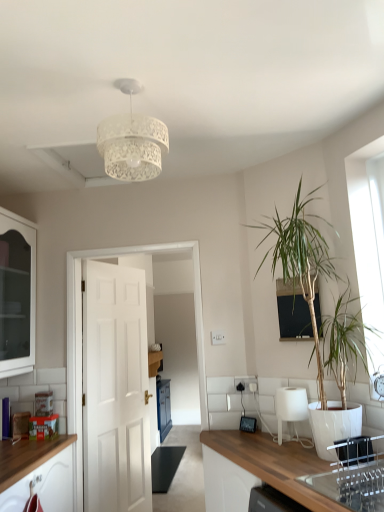
What do you see at coordinates (292, 411) in the screenshot? The image size is (384, 512). I see `white glossy lampshade at lower center` at bounding box center [292, 411].

Where is `green leafy plant at right`? Image resolution: width=384 pixels, height=512 pixels. green leafy plant at right is located at coordinates (301, 260).

What do you see at coordinates (353, 475) in the screenshot?
I see `clear glass sink at lower right` at bounding box center [353, 475].

Where is `white glossy lampshade at lower center`? Image resolution: width=384 pixels, height=512 pixels. white glossy lampshade at lower center is located at coordinates (292, 411).

Where is `appliance below the black glass window screen at upper center (from a real-world perspective)`? This screenshot has width=384, height=512. appliance below the black glass window screen at upper center (from a real-world perspective) is located at coordinates (x=292, y=411).

Does white glossy lampshade at lower center have a greater height compared to black glass window screen at upper center?

No, white glossy lampshade at lower center is not taller than black glass window screen at upper center.

Is point (281, 413) more distant than point (300, 321)?

No.

Which of these two, white glossy lampshade at lower center or black glass window screen at upper center, is thinner?

black glass window screen at upper center.

From the image's perspective, which one is positioned higher, black glass window screen at upper center or green leafy plant at right?

From the image's view, green leafy plant at right is above.

Considering the positions of objects black glass window screen at upper center and green leafy plant at right in the image provided, who is behind, black glass window screen at upper center or green leafy plant at right?

black glass window screen at upper center.

Between point (297, 336) and point (305, 240), which one is positioned in front?

The point (305, 240) is more forward.

Can you tell me how much black glass window screen at upper center and green leafy plant at right differ in facing direction?

There is a 14.5-degree angle between the facing directions of black glass window screen at upper center and green leafy plant at right.

Which is correct: white lace lampshade at upper center is inside green leafy plant at right, or outside of it?

The correct answer is: outside.

From a real-world perspective, between white lace lampshade at upper center and green leafy plant at right, who is vertically lower?

From a 3D spatial view, green leafy plant at right is below.

Considering the relative sizes of white lace lampshade at upper center and green leafy plant at right in the image provided, is white lace lampshade at upper center thinner than green leafy plant at right?

Correct, the width of white lace lampshade at upper center is less than that of green leafy plant at right.

How many degrees apart are the facing directions of white lace lampshade at upper center and green leafy plant at right?

The angle between the facing direction of white lace lampshade at upper center and the facing direction of green leafy plant at right is 25.8 degrees.

Considering the sizes of objects clear glass sink at lower right and white matte door at center in the image provided, who is thinner, clear glass sink at lower right or white matte door at center?

white matte door at center is thinner.

Does clear glass sink at lower right have a smaller size compared to white matte door at center?

Indeed, clear glass sink at lower right has a smaller size compared to white matte door at center.

Does clear glass sink at lower right lie in front of white matte door at center?

Yes, clear glass sink at lower right is closer to the viewer.

Is green leafy plant at right far from white glossy lampshade at lower center?

Actually, green leafy plant at right and white glossy lampshade at lower center are a little close together.

Do you think green leafy plant at right is within white glossy lampshade at lower center, or outside of it?

green leafy plant at right is not enclosed by white glossy lampshade at lower center.

Consider the image. From the image's perspective, is green leafy plant at right located above or below white glossy lampshade at lower center?

green leafy plant at right is above white glossy lampshade at lower center.

How different are the orientations of clear glass sink at lower right and white glass cabinet at left in degrees?

clear glass sink at lower right and white glass cabinet at left are facing 154 degrees away from each other.

Between clear glass sink at lower right and white glass cabinet at left, which one has smaller size?

clear glass sink at lower right.

From the image's perspective, is clear glass sink at lower right above or below white glass cabinet at left?

clear glass sink at lower right is below white glass cabinet at left.

How much distance is there between clear glass sink at lower right and white glass cabinet at left?

clear glass sink at lower right and white glass cabinet at left are 2.03 meters apart.

Considering the sizes of objects white lace lampshade at upper center and black glass window screen at upper center in the image provided, who is taller, white lace lampshade at upper center or black glass window screen at upper center?

With more height is black glass window screen at upper center.

From a real-world perspective, relative to black glass window screen at upper center, is white lace lampshade at upper center vertically above or below?

Clearly, from a real-world perspective, white lace lampshade at upper center is above black glass window screen at upper center.

This screenshot has height=512, width=384. Identify the location of lamp to the left of black glass window screen at upper center. (132, 141).

Where is `window screen above the white glossy lampshade at lower center (from the image's perspective)`? This screenshot has width=384, height=512. window screen above the white glossy lampshade at lower center (from the image's perspective) is located at coordinates (294, 317).

The height and width of the screenshot is (512, 384). In order to click on window screen that appears below the green leafy plant at right (from the image's perspective) in this screenshot , I will do `click(294, 317)`.

When comparing their distances from white lace lampshade at upper center, does green leafy plant at right or clear glass sink at lower right seem further?

clear glass sink at lower right lies further to white lace lampshade at upper center than the other object.

Based on their spatial positions, is black glass window screen at upper center or clear glass sink at lower right closer to white glass cabinet at left?

black glass window screen at upper center is positioned closer to the anchor white glass cabinet at left.

From the image, which object appears to be nearer to black glass window screen at upper center, green leafy plant at right or white glass cabinet at left?

The object closer to black glass window screen at upper center is green leafy plant at right.

When comparing their distances from white lace lampshade at upper center, does white glass cabinet at left or white matte door at center seem further?

Based on the image, white matte door at center appears to be further to white lace lampshade at upper center.

When comparing their distances from black glass window screen at upper center, does white glass cabinet at left or white glossy lampshade at lower center seem closer?

white glossy lampshade at lower center is closer to black glass window screen at upper center.

Estimate the real-world distances between objects in this image. Which object is closer to white glossy lampshade at lower center, black glass window screen at upper center or white glass cabinet at left?

black glass window screen at upper center.

Considering their positions, is white lace lampshade at upper center positioned further to white glass cabinet at left than black glass window screen at upper center?

Result: The object further to white glass cabinet at left is black glass window screen at upper center.

Looking at the image, which one is located further to white lace lampshade at upper center, white glossy lampshade at lower center or green leafy plant at right?

Among the two, white glossy lampshade at lower center is located further to white lace lampshade at upper center.

Identify the location of houseplant between clear glass sink at lower right and white glossy lampshade at lower center from front to back. (301, 260).

At what (x,y) coordinates should I click in order to perform the action: click on window screen between white matte door at center and clear glass sink at lower right. Please return your answer as a coordinate pair (x, y). The width and height of the screenshot is (384, 512). Looking at the image, I should click on (294, 317).

Image resolution: width=384 pixels, height=512 pixels. I want to click on window screen between white lace lampshade at upper center and white matte door at center in the up-down direction, so click(294, 317).

Where is `door situated between white glass cabinet at left and clear glass sink at lower right from left to right`? The width and height of the screenshot is (384, 512). door situated between white glass cabinet at left and clear glass sink at lower right from left to right is located at coordinates (x=115, y=389).